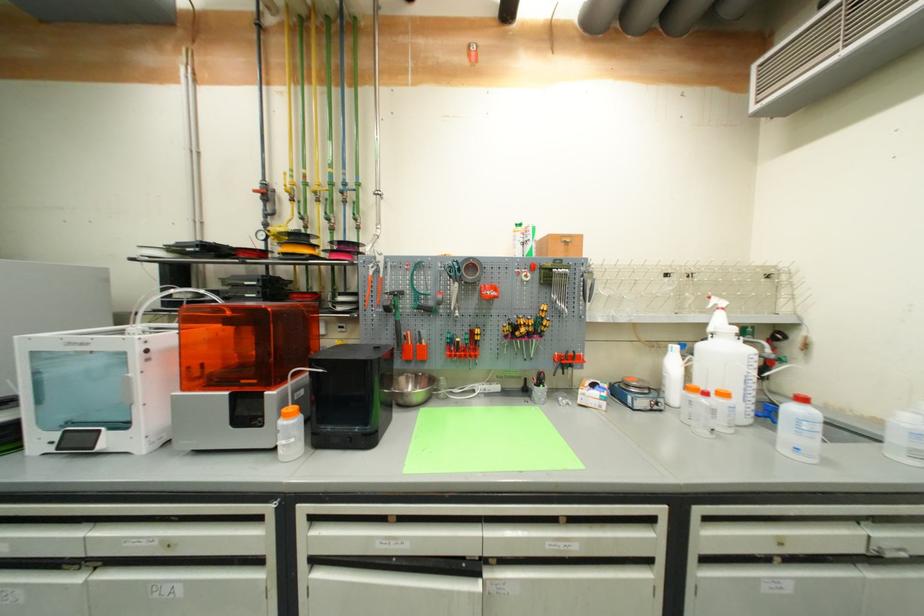
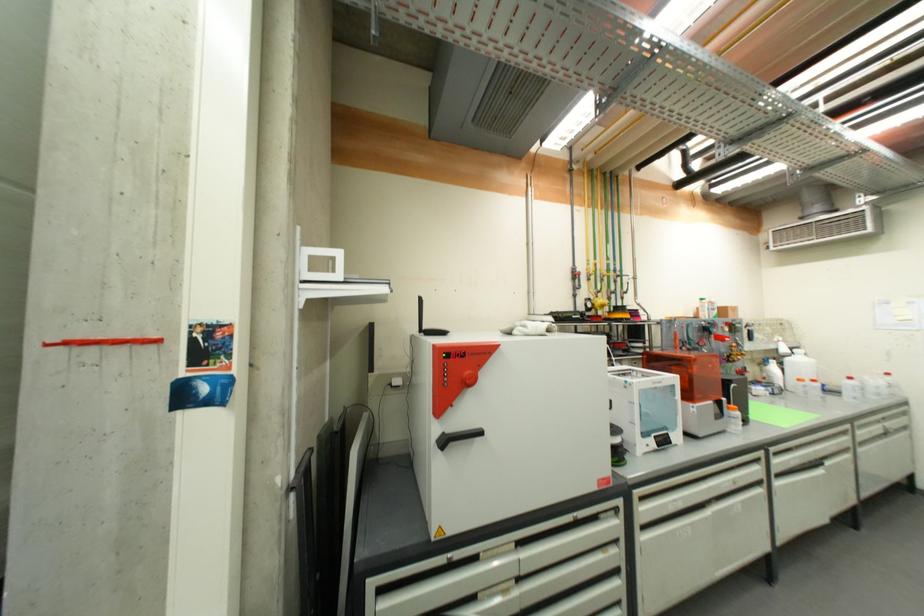
Question: What movement of the cameraman would produce the second image?

Choices:
 (A) Left
 (B) Right
 (C) Forward
 (D) Backward

Answer: (A)